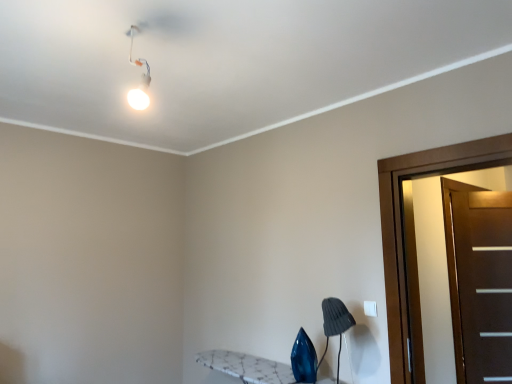
Question: Considering the positions of brown matte door at right, which is the 1th door from right to left, and gray fabric lampshade at lower right in the image, is brown matte door at right, which is the 1th door from right to left, wider or thinner than gray fabric lampshade at lower right?

Choices:
 (A) wide
 (B) thin

Answer: (B)

Question: Is brown matte door at right, the 1th door viewed from the back, bigger or smaller than gray fabric lampshade at lower right?

Choices:
 (A) big
 (B) small

Answer: (A)

Question: Which is farther from the white glossy light fixture at upper left?

Choices:
 (A) blue glass swivel chair at lower right
 (B) brown matte door at right, which is the 1th door from right to left
 (C) gray fabric lampshade at lower right
 (D) dark brown wood door at right, the second door in the right-to-left sequence

Answer: (B)

Question: Which is nearer to the brown matte door at right, which is the 1th door from right to left?

Choices:
 (A) blue glass swivel chair at lower right
 (B) gray fabric lampshade at lower right
 (C) white glossy light fixture at upper left
 (D) dark brown wood door at right, the 1th door positioned from the left

Answer: (D)